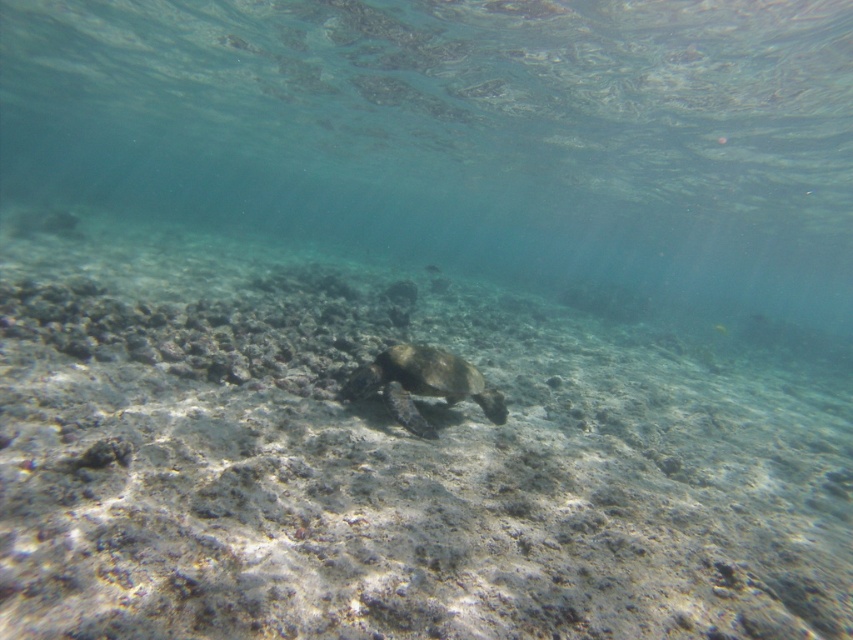
Question: Can you confirm if brown rocky coral reef at center is wider than greenish-brown textured shell at center?

Choices:
 (A) no
 (B) yes

Answer: (B)

Question: Which point appears closest to the camera in this image?

Choices:
 (A) (416, 429)
 (B) (424, 614)

Answer: (B)

Question: Which point is closer to the camera taking this photo?

Choices:
 (A) pos(143,339)
 (B) pos(379,384)

Answer: (B)

Question: Is brown rocky coral reef at center bigger than greenish-brown textured shell at center?

Choices:
 (A) yes
 (B) no

Answer: (A)

Question: Observing the image, what is the correct spatial positioning of brown rocky coral reef at center in reference to greenish-brown textured shell at center?

Choices:
 (A) left
 (B) right

Answer: (A)